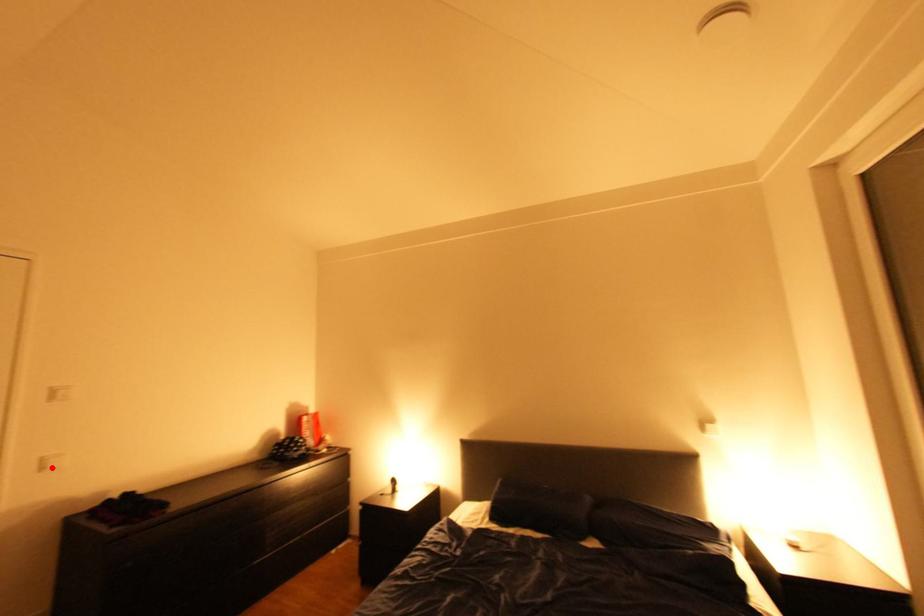
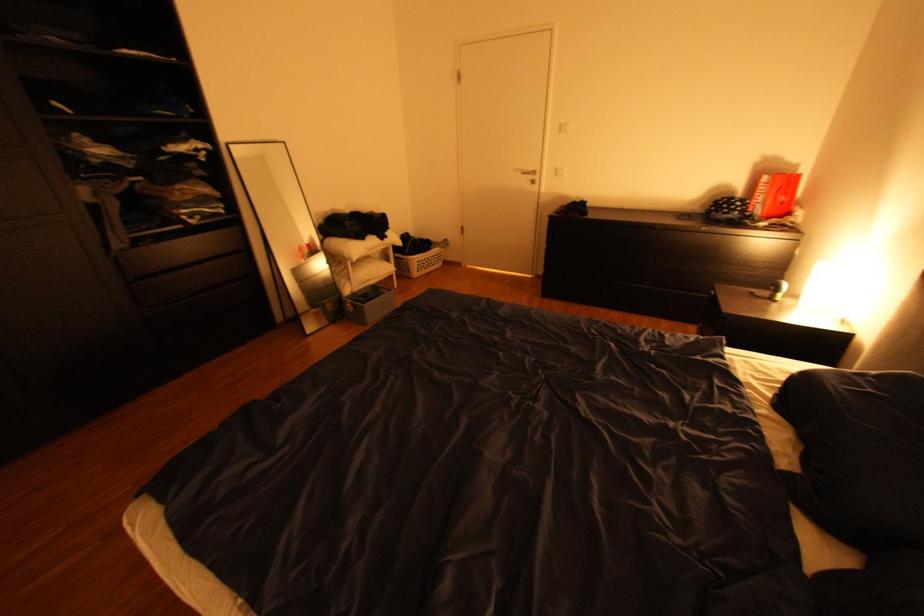
Question: I am providing you with two images of the same scene from different viewpoints. In image1, a red point is highlighted. Considering the same 3D point in image2, which of the following is correct?

Choices:
 (A) It is closer
 (B) It is farther

Answer: (A)